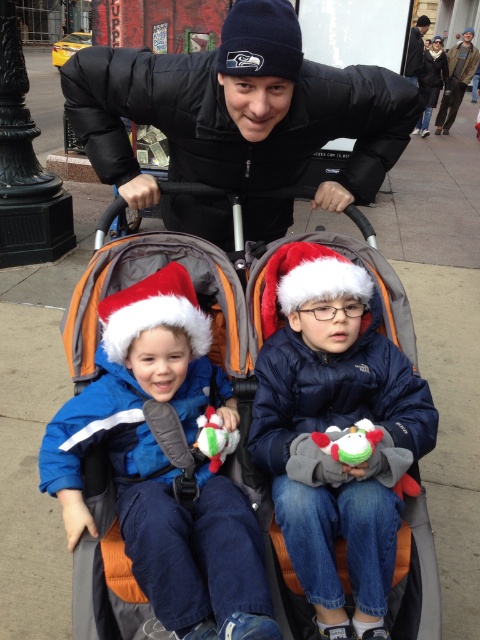
Question: Which point is closer to the camera taking this photo?

Choices:
 (A) (149, 557)
 (B) (463, 56)
 (C) (81, 445)

Answer: (A)

Question: Is blue fleece jacket at left bigger than black leather jacket at upper center?

Choices:
 (A) yes
 (B) no

Answer: (A)

Question: Observing the image, what is the correct spatial positioning of black matte jacket at upper center in reference to navy blue jacket at center?

Choices:
 (A) left
 (B) right

Answer: (A)

Question: Does black matte jacket at upper center have a smaller size compared to dark blue knit hat at upper center?

Choices:
 (A) no
 (B) yes

Answer: (B)

Question: Which object is positioned closest to the black leather jacket at upper center?

Choices:
 (A) blue fleece jacket at left
 (B) dark blue knit hat at upper center
 (C) navy blue jacket at center
 (D) black matte jacket at upper center

Answer: (B)

Question: Estimate the real-world distances between objects in this image. Which object is closer to the black leather jacket at upper center?

Choices:
 (A) black matte jacket at upper center
 (B) blue fleece jacket at left
 (C) navy blue jacket at center
 (D) orange fabric baby carriage at center

Answer: (A)